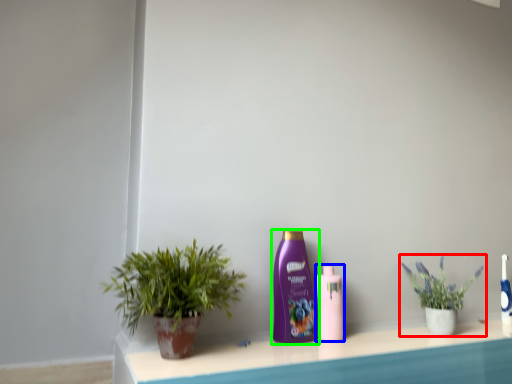
Question: Which object is positioned farthest from houseplant (highlighted by a red box)? Select from bottle (highlighted by a blue box) and bottle (highlighted by a green box).

Choices:
 (A) bottle
 (B) bottle

Answer: (B)